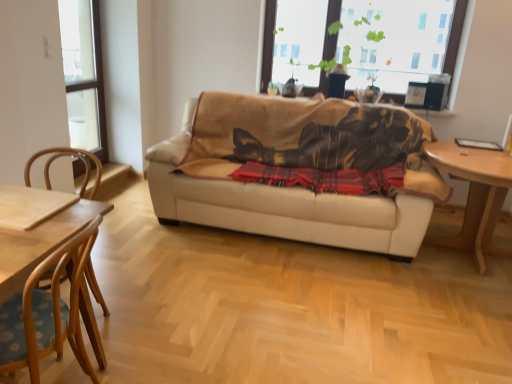
Question: Is transparent glass window at upper left, the first window from the left, at the back of light brown wooden table at right?

Choices:
 (A) yes
 (B) no

Answer: (B)

Question: Considering the relative positions of light brown wooden table at right and transparent glass window at upper left, the second window viewed from the right, in the image provided, is light brown wooden table at right behind transparent glass window at upper left, the second window viewed from the right,?

Choices:
 (A) no
 (B) yes

Answer: (A)

Question: Is light brown wooden table at right not near transparent glass window at upper left, the second window viewed from the right?

Choices:
 (A) no
 (B) yes

Answer: (B)

Question: From a real-world perspective, is light brown wooden table at right physically above transparent glass window at upper left, the second window viewed from the right?

Choices:
 (A) yes
 (B) no

Answer: (B)

Question: Does light brown wooden table at right have a lesser width compared to transparent glass window at upper left, the first window from the left?

Choices:
 (A) no
 (B) yes

Answer: (A)

Question: From the image's perspective, is wooden chair at left, the 1th chair positioned from the front, located above or below red plaid blanket at center?

Choices:
 (A) below
 (B) above

Answer: (A)

Question: Considering the positions of wooden chair at left, which is counted as the second chair, starting from the back, and red plaid blanket at center in the image, is wooden chair at left, which is counted as the second chair, starting from the back, wider or thinner than red plaid blanket at center?

Choices:
 (A) wide
 (B) thin

Answer: (A)

Question: From a real-world perspective, is wooden chair at left, the 1th chair positioned from the front, positioned above or below red plaid blanket at center?

Choices:
 (A) above
 (B) below

Answer: (B)

Question: Do you think wooden chair at left, which is counted as the second chair, starting from the back, is within red plaid blanket at center, or outside of it?

Choices:
 (A) outside
 (B) inside

Answer: (A)

Question: Do you think red plaid blanket at center is within beige leather couch at center, or outside of it?

Choices:
 (A) inside
 (B) outside

Answer: (A)

Question: From the image's perspective, is red plaid blanket at center positioned above or below beige leather couch at center?

Choices:
 (A) below
 (B) above

Answer: (A)

Question: Is red plaid blanket at center taller or shorter than beige leather couch at center?

Choices:
 (A) short
 (B) tall

Answer: (A)

Question: Considering the positions of red plaid blanket at center and beige leather couch at center in the image, is red plaid blanket at center wider or thinner than beige leather couch at center?

Choices:
 (A) thin
 (B) wide

Answer: (A)

Question: In the image, is wooden chair at left, the 1th chair positioned from the front, positioned in front of or behind light brown wooden table at right?

Choices:
 (A) behind
 (B) front

Answer: (B)

Question: Is point (81, 344) closer or farther from the camera than point (496, 208)?

Choices:
 (A) closer
 (B) farther

Answer: (A)